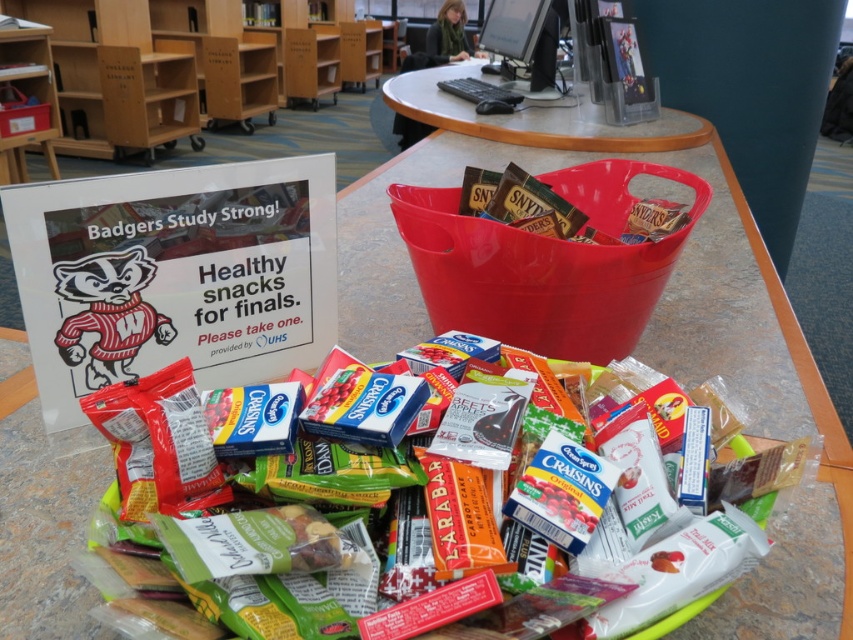
Can you confirm if light brown wood bookshelf at upper left is taller than matte plastic bag of mixed snacks at center?

Yes.

Measure the distance from light brown wood bookshelf at upper left to matte plastic bag of mixed snacks at center.

light brown wood bookshelf at upper left and matte plastic bag of mixed snacks at center are 5.52 meters apart.

Who is more forward, (218, 84) or (227, 554)?

Positioned in front is point (227, 554).

Identify the location of light brown wood bookshelf at upper left. (180, 86).

Does light brown wood bookshelf at upper left appear over wooden table at center?

Yes.

Can you confirm if light brown wood bookshelf at upper left is smaller than wooden table at center?

Incorrect, light brown wood bookshelf at upper left is not smaller in size than wooden table at center.

The image size is (853, 640). In order to click on light brown wood bookshelf at upper left in this screenshot , I will do `click(180, 86)`.

Which is in front, point (235, 600) or point (541, 125)?

Point (235, 600) is more forward.

Which is behind, point (757, 540) or point (555, 147)?

The point (555, 147) is more distant.

At what (x,y) coordinates should I click in order to perform the action: click on matte plastic bag of mixed snacks at center. Please return your answer as a coordinate pair (x, y). The height and width of the screenshot is (640, 853). Looking at the image, I should click on (680, 572).

Locate an element on the screen. The width and height of the screenshot is (853, 640). matte plastic bag of mixed snacks at center is located at coordinates (680, 572).